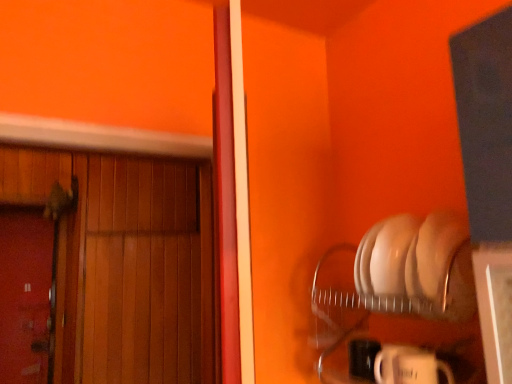
Identify the location of wooden door at left, marked as the 1th door in a right-to-left arrangement. pos(147,272).

What do you see at coordinates (147, 272) in the screenshot?
I see `wooden door at left, marked as the 1th door in a right-to-left arrangement` at bounding box center [147, 272].

Measure the distance between point (x=88, y=164) and camera.

7.20 feet.

Image resolution: width=512 pixels, height=384 pixels. Identify the location of smooth wooden door at left, acting as the second door starting from the right. (25, 294).

This screenshot has width=512, height=384. What do you see at coordinates (25, 294) in the screenshot?
I see `smooth wooden door at left, the first door positioned from the left` at bounding box center [25, 294].

Measure the distance between smooth wooden door at left, the first door positioned from the left, and camera.

They are 8.11 feet apart.

You are a GUI agent. You are given a task and a screenshot of the screen. Output one action in this format:
    pyautogui.click(x=<x>, y=<y>)
    Task: Click on the wooden door at left, which appears as the second door when viewed from the left
    
    Given the screenshot: What is the action you would take?
    pyautogui.click(x=147, y=272)

Based on their positions, is smooth wooden door at left, acting as the second door starting from the right, located to the left or right of wooden door at left, which appears as the second door when viewed from the left?

In the image, smooth wooden door at left, acting as the second door starting from the right, appears on the left side of wooden door at left, which appears as the second door when viewed from the left.

Is smooth wooden door at left, the first door positioned from the left, closer to the viewer compared to wooden door at left, marked as the 1th door in a right-to-left arrangement?

No, the depth of smooth wooden door at left, the first door positioned from the left, is greater than that of wooden door at left, marked as the 1th door in a right-to-left arrangement.

Is point (49, 229) more distant than point (141, 328)?

Yes, it is.

From the image's perspective, is smooth wooden door at left, acting as the second door starting from the right, located above or below wooden door at left, marked as the 1th door in a right-to-left arrangement?

From the image's perspective, smooth wooden door at left, acting as the second door starting from the right, appears below wooden door at left, marked as the 1th door in a right-to-left arrangement.

Based on the photo, from a real-world perspective, does smooth wooden door at left, acting as the second door starting from the right, sit lower than wooden door at left, marked as the 1th door in a right-to-left arrangement?

Yes.

In the scene shown: Considering the sizes of smooth wooden door at left, the first door positioned from the left, and wooden door at left, marked as the 1th door in a right-to-left arrangement, in the image, is smooth wooden door at left, the first door positioned from the left, wider or thinner than wooden door at left, marked as the 1th door in a right-to-left arrangement,?

In the image, smooth wooden door at left, the first door positioned from the left, appears to be more narrow than wooden door at left, marked as the 1th door in a right-to-left arrangement.

From their relative heights in the image, would you say smooth wooden door at left, acting as the second door starting from the right, is taller or shorter than wooden door at left, marked as the 1th door in a right-to-left arrangement?

smooth wooden door at left, acting as the second door starting from the right, is shorter than wooden door at left, marked as the 1th door in a right-to-left arrangement.

Looking at the image, does smooth wooden door at left, acting as the second door starting from the right, seem bigger or smaller compared to wooden door at left, which appears as the second door when viewed from the left?

smooth wooden door at left, acting as the second door starting from the right, is smaller than wooden door at left, which appears as the second door when viewed from the left.

Could wooden door at left, which appears as the second door when viewed from the left, be considered to be inside smooth wooden door at left, the first door positioned from the left?

That's incorrect, wooden door at left, which appears as the second door when viewed from the left, is not inside smooth wooden door at left, the first door positioned from the left.

Can you see smooth wooden door at left, acting as the second door starting from the right, touching wooden door at left, which appears as the second door when viewed from the left?

smooth wooden door at left, acting as the second door starting from the right, and wooden door at left, which appears as the second door when viewed from the left, are clearly separated.

Consider the image. Could you tell me if smooth wooden door at left, acting as the second door starting from the right, is turned towards wooden door at left, which appears as the second door when viewed from the left?

No, smooth wooden door at left, acting as the second door starting from the right, is not aimed at wooden door at left, which appears as the second door when viewed from the left.

How much distance is there between smooth wooden door at left, the first door positioned from the left, and wooden door at left, which appears as the second door when viewed from the left?

A distance of 31.69 inches exists between smooth wooden door at left, the first door positioned from the left, and wooden door at left, which appears as the second door when viewed from the left.

Locate an element on the screen. door positioned vertically above the smooth wooden door at left, acting as the second door starting from the right (from a real-world perspective) is located at coordinates (147, 272).

Which object is positioned more to the right, wooden door at left, marked as the 1th door in a right-to-left arrangement, or smooth wooden door at left, acting as the second door starting from the right?

From the viewer's perspective, wooden door at left, marked as the 1th door in a right-to-left arrangement, appears more on the right side.

In the image, is wooden door at left, marked as the 1th door in a right-to-left arrangement, positioned in front of or behind smooth wooden door at left, acting as the second door starting from the right?

In the image, wooden door at left, marked as the 1th door in a right-to-left arrangement, appears in front of smooth wooden door at left, acting as the second door starting from the right.

Which is in front, point (154, 252) or point (54, 222)?

Positioned in front is point (154, 252).

From the image's perspective, between wooden door at left, marked as the 1th door in a right-to-left arrangement, and smooth wooden door at left, acting as the second door starting from the right, who is located below?

smooth wooden door at left, acting as the second door starting from the right, is shown below in the image.

From a real-world perspective, does wooden door at left, which appears as the second door when viewed from the left, sit lower than smooth wooden door at left, the first door positioned from the left?

No.

Does wooden door at left, marked as the 1th door in a right-to-left arrangement, have a greater width compared to smooth wooden door at left, the first door positioned from the left?

Yes, wooden door at left, marked as the 1th door in a right-to-left arrangement, is wider than smooth wooden door at left, the first door positioned from the left.

Considering the relative sizes of wooden door at left, which appears as the second door when viewed from the left, and smooth wooden door at left, acting as the second door starting from the right, in the image provided, is wooden door at left, which appears as the second door when viewed from the left, shorter than smooth wooden door at left, acting as the second door starting from the right,?

No, wooden door at left, which appears as the second door when viewed from the left, is not shorter than smooth wooden door at left, acting as the second door starting from the right.

Does wooden door at left, which appears as the second door when viewed from the left, have a larger size compared to smooth wooden door at left, acting as the second door starting from the right?

Yes, wooden door at left, which appears as the second door when viewed from the left, is bigger than smooth wooden door at left, acting as the second door starting from the right.

In the scene shown: Is wooden door at left, marked as the 1th door in a right-to-left arrangement, situated inside smooth wooden door at left, acting as the second door starting from the right, or outside?

The correct answer is: outside.

Is wooden door at left, which appears as the second door when viewed from the left, in contact with smooth wooden door at left, acting as the second door starting from the right?

wooden door at left, which appears as the second door when viewed from the left, and smooth wooden door at left, acting as the second door starting from the right, are not in contact.

Is wooden door at left, which appears as the second door when viewed from the left, facing away from smooth wooden door at left, acting as the second door starting from the right?

No, wooden door at left, which appears as the second door when viewed from the left, is not facing away from smooth wooden door at left, acting as the second door starting from the right.

How different are the orientations of wooden door at left, marked as the 1th door in a right-to-left arrangement, and smooth wooden door at left, the first door positioned from the left, in degrees?

0.197 degrees separate the facing orientations of wooden door at left, marked as the 1th door in a right-to-left arrangement, and smooth wooden door at left, the first door positioned from the left.

How distant is wooden door at left, marked as the 1th door in a right-to-left arrangement, from smooth wooden door at left, the first door positioned from the left?

31.69 inches.

Locate an element on the screen. The image size is (512, 384). door that is behind the wooden door at left, marked as the 1th door in a right-to-left arrangement is located at coordinates (25, 294).

Locate an element on the screen. door that is above the smooth wooden door at left, acting as the second door starting from the right (from the image's perspective) is located at coordinates (147, 272).

Identify the location of door behind the wooden door at left, which appears as the second door when viewed from the left. (25, 294).